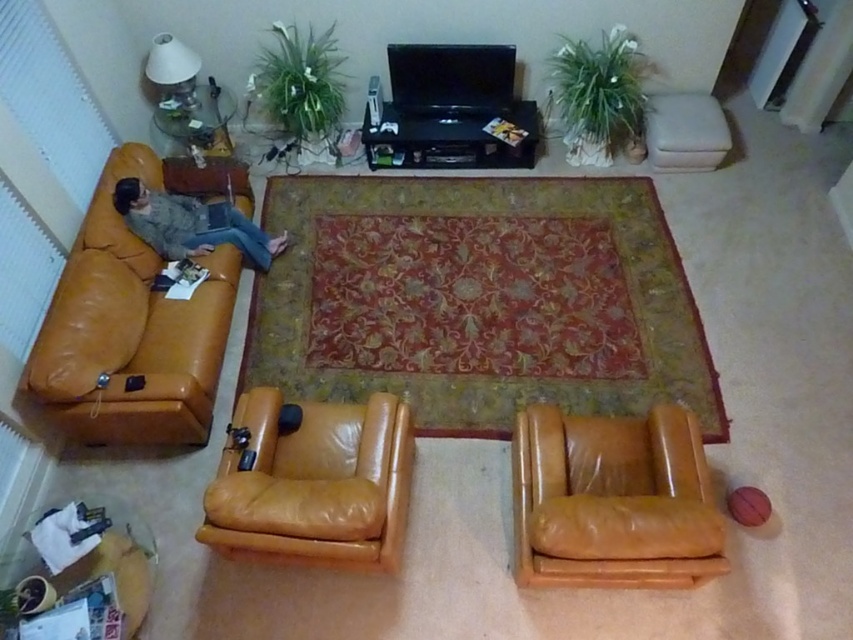
Question: Estimate the real-world distances between objects in this image. Which object is closer to the matte tan leather armchair at center?

Choices:
 (A) leather couch at left
 (B) matte brown leather couch at left

Answer: (A)

Question: Is leather couch at left positioned behind leather armchair at lower right?

Choices:
 (A) yes
 (B) no

Answer: (A)

Question: Can you confirm if leather couch at left is positioned above leather armchair at lower right?

Choices:
 (A) yes
 (B) no

Answer: (A)

Question: Among these objects, which one is farthest from the camera?

Choices:
 (A) leather armchair at lower right
 (B) matte brown leather couch at left
 (C) leather couch at left

Answer: (B)

Question: Which of the following is the farthest from the observer?

Choices:
 (A) leather armchair at lower right
 (B) matte tan leather armchair at center

Answer: (B)

Question: Does leather couch at left have a larger size compared to matte brown leather couch at left?

Choices:
 (A) yes
 (B) no

Answer: (A)